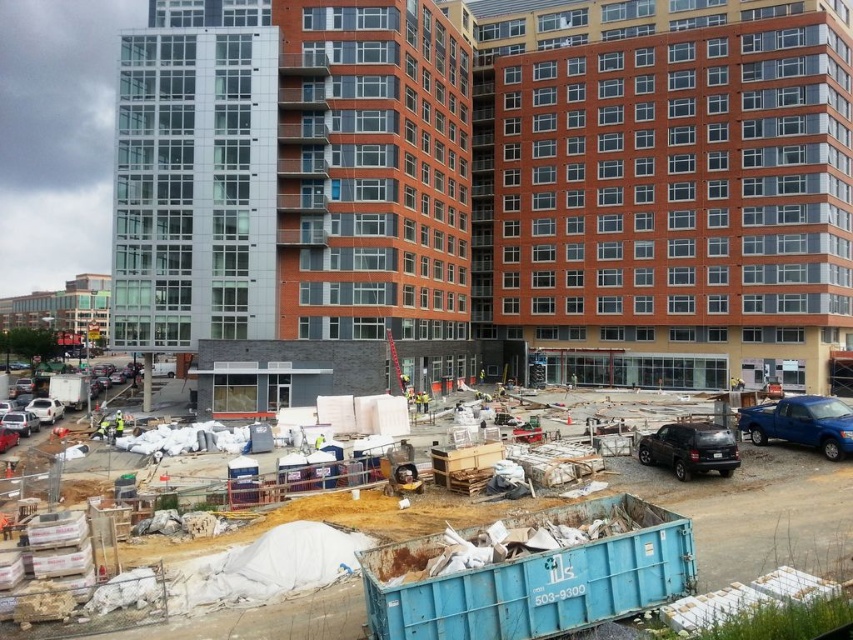
Does point (795, 435) come farther from viewer compared to point (39, 420)?

That is False.

Describe the element at coordinates (801, 422) in the screenshot. I see `blue metallic truck at lower right` at that location.

Who is more distant from viewer, (827, 412) or (44, 413)?

Point (44, 413)

At what (x,y) coordinates should I click in order to perform the action: click on blue metallic truck at lower right. Please return your answer as a coordinate pair (x, y). Image resolution: width=853 pixels, height=640 pixels. Looking at the image, I should click on (801, 422).

Is blue plastic container at center behind blue metallic truck at lower right?

No, blue plastic container at center is closer to the viewer.

Which is more to the left, blue plastic container at center or blue metallic truck at lower right?

From the viewer's perspective, blue plastic container at center appears more on the left side.

Image resolution: width=853 pixels, height=640 pixels. Identify the location of blue plastic container at center. (755, 509).

Can you confirm if white matte car at lower left is positioned above yellow reflective vest at center?

Actually, white matte car at lower left is below yellow reflective vest at center.

Does point (55, 406) come behind point (117, 417)?

Yes, it is.

I want to click on white matte car at lower left, so pyautogui.click(x=45, y=410).